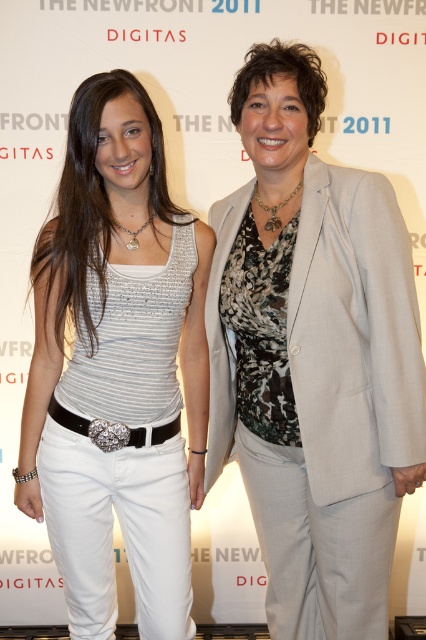
You are a fashion designer analyzing the image. You need to determine which of the two items, the white matte pants at left or the light gray fabric business suit at center, has a greater height measurement. Based on the scene description, which one is taller?

The white matte pants at left is much taller as light gray fabric business suit at center.

You are a photographer setting up for a photoshoot. You need to position a spotlight to highlight both the white matte pants at left and the light gray fabric business suit at center. Since the spotlight can only illuminate a single area, where should you place it to ensure both items are adequately lit?

Place the spotlight between the white matte pants at left and the light gray fabric business suit at center so that both are within its coverage area.